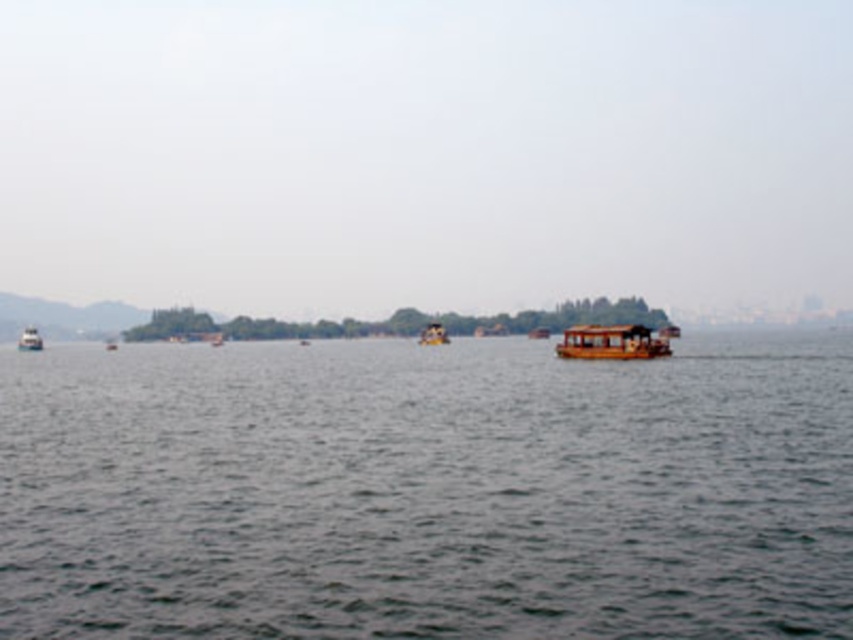
Identify the location of wooden boat at right. (612, 342).

Who is more distant from viewer, (614, 346) or (432, 326)?

The point (432, 326) is behind.

What do you see at coordinates (612, 342) in the screenshot? This screenshot has width=853, height=640. I see `wooden boat at right` at bounding box center [612, 342].

Locate an element on the screen. The width and height of the screenshot is (853, 640). wooden boat at right is located at coordinates (612, 342).

Can you confirm if dark gray water at center is bigger than wooden boat at right?

Correct, dark gray water at center is larger in size than wooden boat at right.

Between point (180, 440) and point (653, 340), which one is positioned behind?

The point (653, 340) is behind.

Is point (654, 528) positioned after point (634, 344)?

That is False.

At what (x,y) coordinates should I click in order to perform the action: click on dark gray water at center. Please return your answer as a coordinate pair (x, y). Image resolution: width=853 pixels, height=640 pixels. Looking at the image, I should click on (428, 492).

Is wooden boat at right wider than wooden boat at left?

Incorrect, wooden boat at right's width does not surpass wooden boat at left's.

Does wooden boat at right have a smaller size compared to wooden boat at left?

Correct, wooden boat at right occupies less space than wooden boat at left.

In order to click on wooden boat at right in this screenshot , I will do (612, 342).